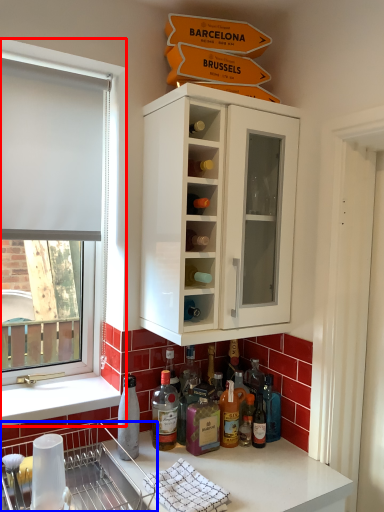
Question: Among these objects, which one is farthest to the camera, window (highlighted by a red box) or dish washer (highlighted by a blue box)?

Choices:
 (A) window
 (B) dish washer

Answer: (A)